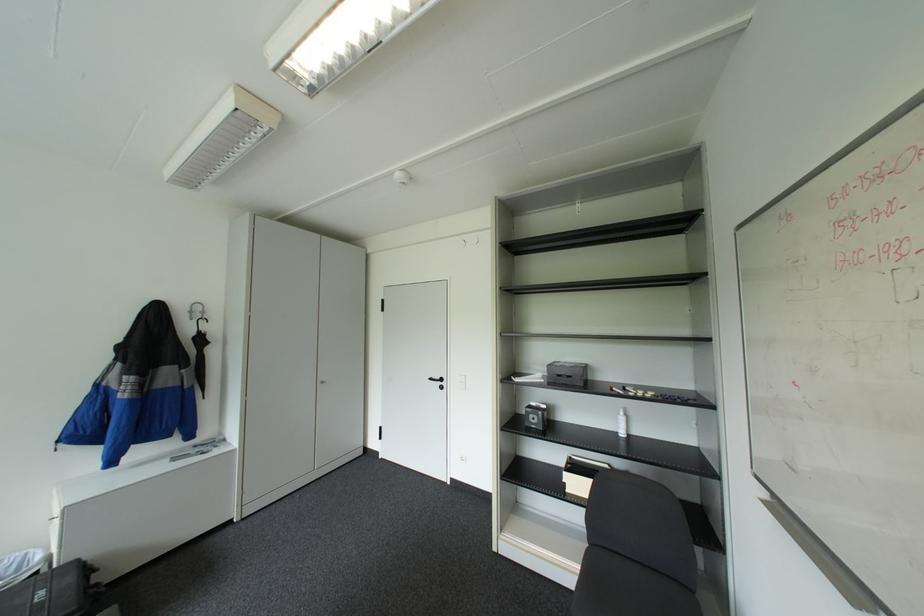
Describe the element at coordinates (460, 381) in the screenshot. I see `the white light switch` at that location.